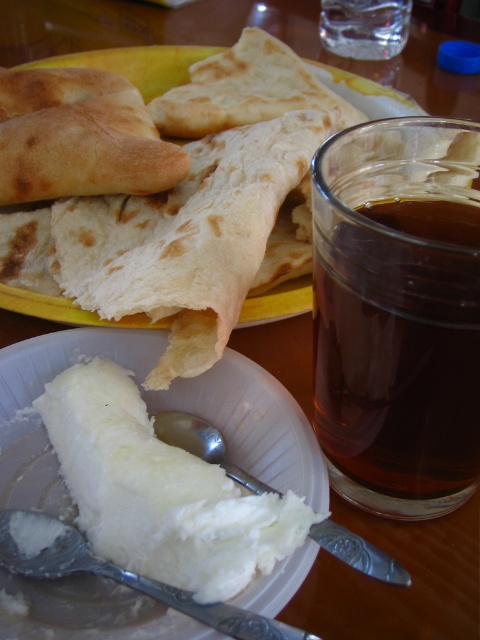
You are a waiter trying to clear the table. You see the silver metallic spoon at lower left and the silver metallic spoon at lower center. Which spoon should you pick up first to avoid obstructing the other?

You should pick up the silver metallic spoon at lower left first because it is in front of the silver metallic spoon at lower center, so removing it first will allow access to the one behind without obstruction.

You are a diner who wants to eat the white creamy mashed potato at center. Where should you place your hand to pick up the silver metallic spoon at lower left?

The silver metallic spoon at lower left is located below the white creamy mashed potato at center, so you should reach downward from the white creamy mashed potato at center to pick up the silver metallic spoon at lower left.

You are a server in a restaurant and need to choose the longer spoon to serve a customer. Which spoon should you choose between the silver metallic spoon at lower left and the silver metallic spoon at lower center?

The silver metallic spoon at lower center is longer than the silver metallic spoon at lower left, so you should choose the silver metallic spoon at lower center.